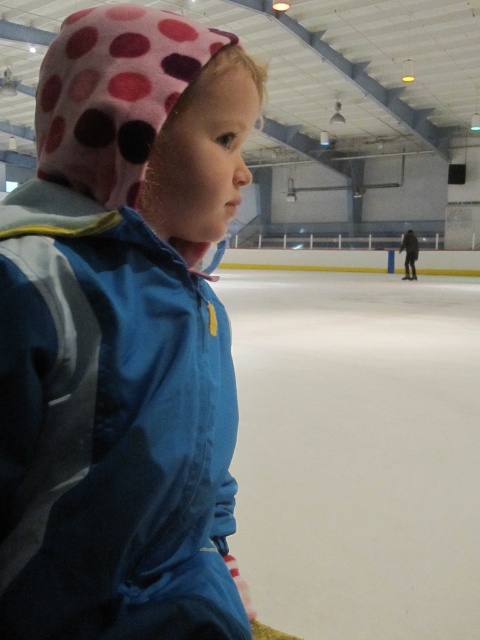
Does blue fabric jacket at left appear under white smooth ice at center?

Correct, blue fabric jacket at left is located below white smooth ice at center.

The height and width of the screenshot is (640, 480). Identify the location of blue fabric jacket at left. (108, 420).